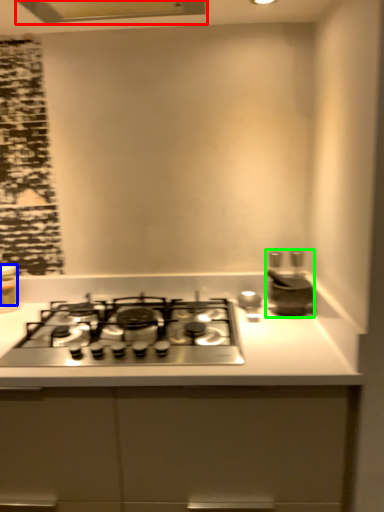
Question: Considering the real-world distances, which object is farthest from exhaust hood (highlighted by a red box)? kitchen appliance (highlighted by a blue box) or appliance (highlighted by a green box)?

Choices:
 (A) kitchen appliance
 (B) appliance

Answer: (B)